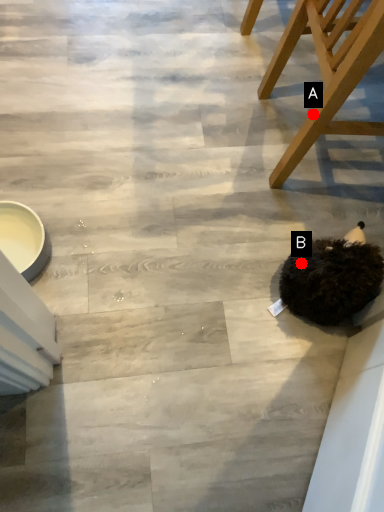
Question: Two points are circled on the image, labeled by A and B beside each circle. Which point is closer to the camera?

Choices:
 (A) A is closer
 (B) B is closer

Answer: (A)